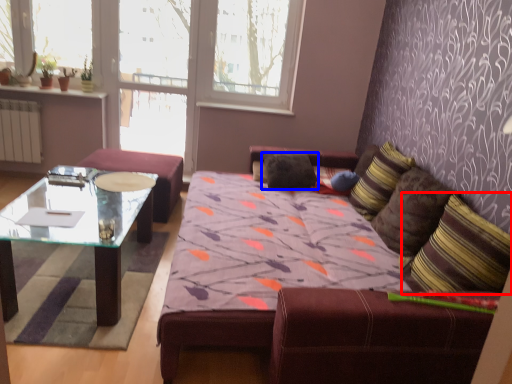
Question: Which of the following is the farthest to the observer, throw pillow (highlighted by a red box) or pillow (highlighted by a blue box)?

Choices:
 (A) throw pillow
 (B) pillow

Answer: (B)